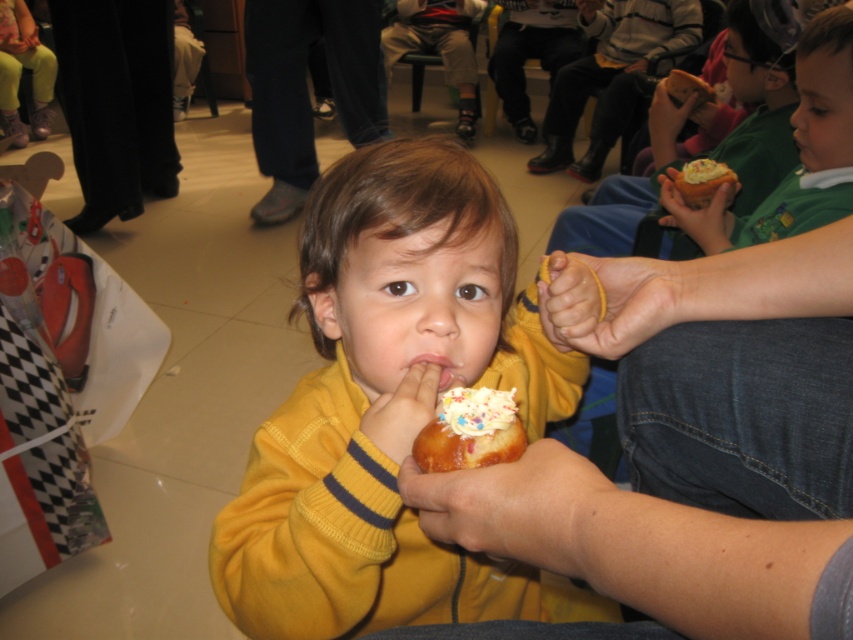
Question: Among these points, which one is farthest from the camera?

Choices:
 (A) (380, 406)
 (B) (434, 432)
 (C) (479, 429)
 (D) (834, 90)

Answer: (D)

Question: Estimate the real-world distances between objects in this image. Which object is closer to the pink glossy lips at center?

Choices:
 (A) white creamy frosting at center
 (B) matte green shirt at upper right

Answer: (A)

Question: Which object is closer to the camera taking this photo?

Choices:
 (A) white frosted donut at upper right
 (B) pink glossy lips at center
 (C) yellow soft sweater at center

Answer: (C)

Question: Does yellow soft sweater at center have a larger size compared to pink glossy lips at center?

Choices:
 (A) yes
 (B) no

Answer: (A)

Question: Does yellow soft sweater at center have a smaller size compared to glazed doughnut at center?

Choices:
 (A) yes
 (B) no

Answer: (B)

Question: Is glazed doughnut at center in front of white frosted donut at upper right?

Choices:
 (A) yes
 (B) no

Answer: (A)